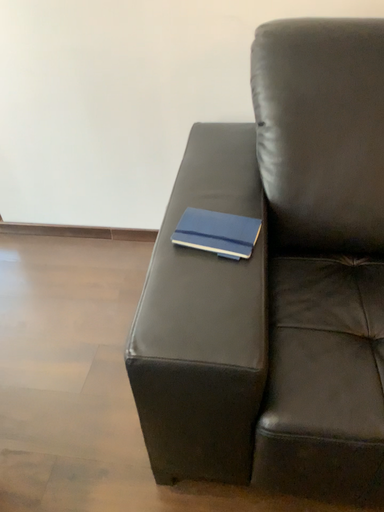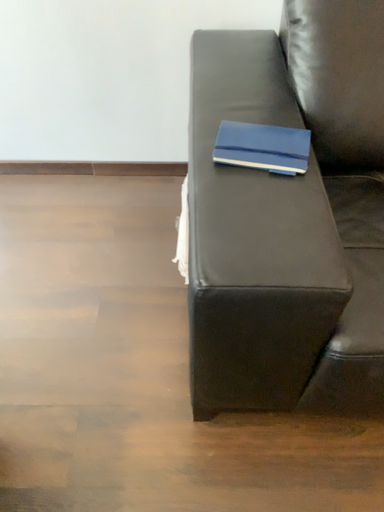
Question: How did the camera likely rotate when shooting the video?

Choices:
 (A) rotated upward
 (B) rotated downward

Answer: (B)